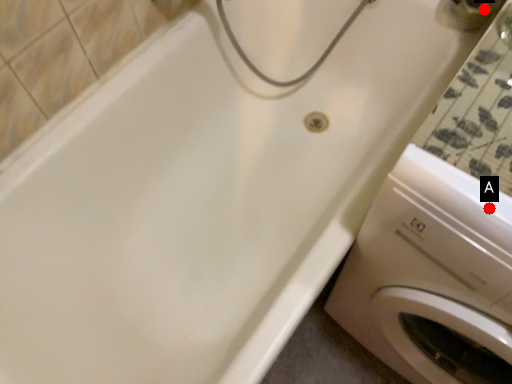
Question: Two points are circled on the image, labeled by A and B beside each circle. Among these points, which one is farthest from the camera?

Choices:
 (A) A is further
 (B) B is further

Answer: (B)